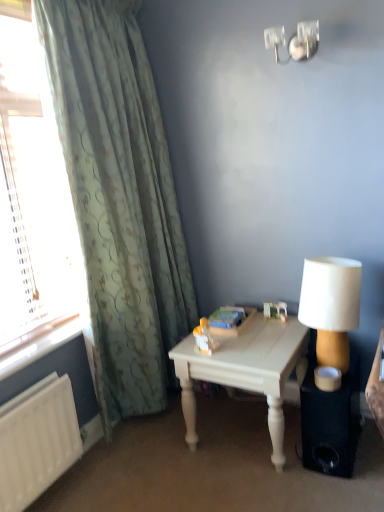
Question: Considering the relative sizes of clear glass window at left and white painted wood table at center in the image provided, is clear glass window at left smaller than white painted wood table at center?

Choices:
 (A) no
 (B) yes

Answer: (B)

Question: Considering the relative positions of clear glass window at left and white painted wood table at center in the image provided, is clear glass window at left behind white painted wood table at center?

Choices:
 (A) no
 (B) yes

Answer: (A)

Question: Is clear glass window at left directly adjacent to white painted wood table at center?

Choices:
 (A) no
 (B) yes

Answer: (A)

Question: Is clear glass window at left to the left of white painted wood table at center from the viewer's perspective?

Choices:
 (A) no
 (B) yes

Answer: (B)

Question: Are clear glass window at left and white painted wood table at center located far from each other?

Choices:
 (A) no
 (B) yes

Answer: (A)

Question: Would you say green textured curtain at left is inside or outside white painted wood table at center?

Choices:
 (A) outside
 (B) inside

Answer: (A)

Question: In the image, is green textured curtain at left positioned in front of or behind white painted wood table at center?

Choices:
 (A) front
 (B) behind

Answer: (A)

Question: Considering the positions of green textured curtain at left and white painted wood table at center in the image, is green textured curtain at left taller or shorter than white painted wood table at center?

Choices:
 (A) short
 (B) tall

Answer: (B)

Question: From a real-world perspective, is green textured curtain at left physically located above or below white painted wood table at center?

Choices:
 (A) below
 (B) above

Answer: (B)

Question: Does point (327, 425) appear closer or farther from the camera than point (357, 278)?

Choices:
 (A) farther
 (B) closer

Answer: (A)

Question: Considering the positions of black matte speaker at lower right and white fabric lampshade at right in the image, is black matte speaker at lower right taller or shorter than white fabric lampshade at right?

Choices:
 (A) tall
 (B) short

Answer: (B)

Question: Is black matte speaker at lower right in front of or behind white fabric lampshade at right in the image?

Choices:
 (A) front
 (B) behind

Answer: (B)

Question: Is black matte speaker at lower right to the left or to the right of white fabric lampshade at right in the image?

Choices:
 (A) right
 (B) left

Answer: (A)

Question: Is white painted wood table at center inside the boundaries of clear glass window at left, or outside?

Choices:
 (A) outside
 (B) inside

Answer: (A)

Question: Does point (187, 379) appear closer or farther from the camera than point (33, 324)?

Choices:
 (A) farther
 (B) closer

Answer: (A)